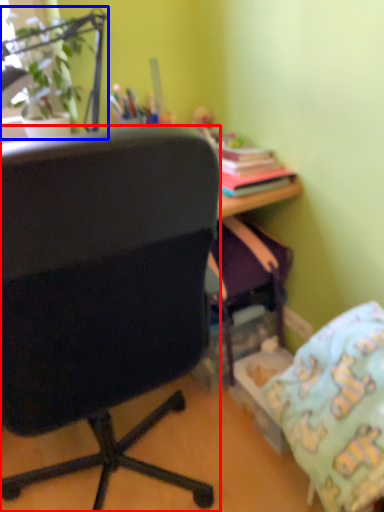
Question: Which of the following is the closest to the observer, chair (highlighted by a red box) or houseplant (highlighted by a blue box)?

Choices:
 (A) chair
 (B) houseplant

Answer: (A)